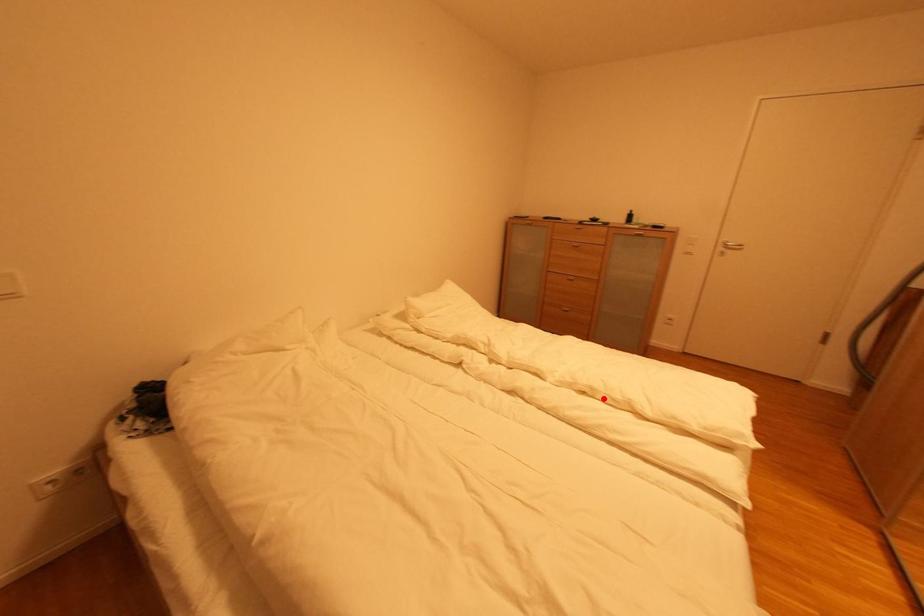
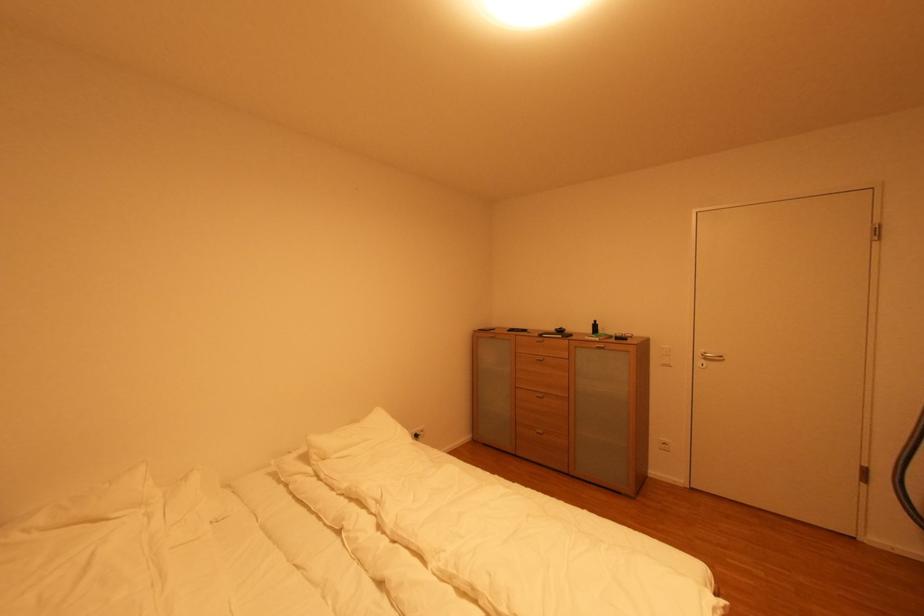
Locate, in the second image, the point that corresponds to the highlighted location in the first image.

(485, 606)